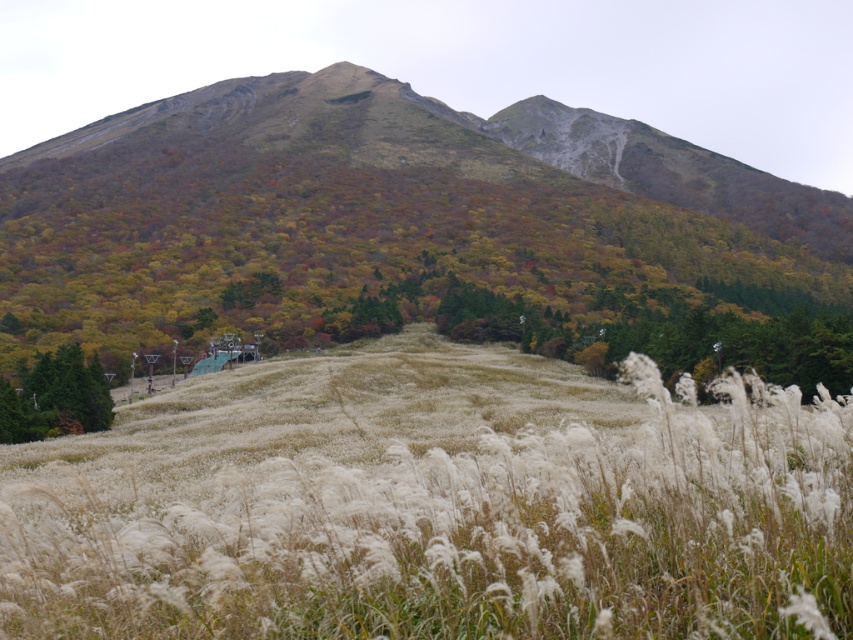
You are standing in the field of tall white grasses and want to take a photo of the multicolored foliage at upper center and the green matte tree at lower left. Which object should you point your camera upwards to capture?

You should point your camera upwards to capture the multicolored foliage at upper center because it is located above the green matte tree at lower left.

You are planning to take a photo of the white fluffy grass at center and the multicolored foliage at upper center. Which object should you focus on first if you want both to be in sharp focus, considering their sizes?

You should focus on the multicolored foliage at upper center first because it is larger than the white fluffy grass at center, allowing for a greater depth of field to keep both in focus.